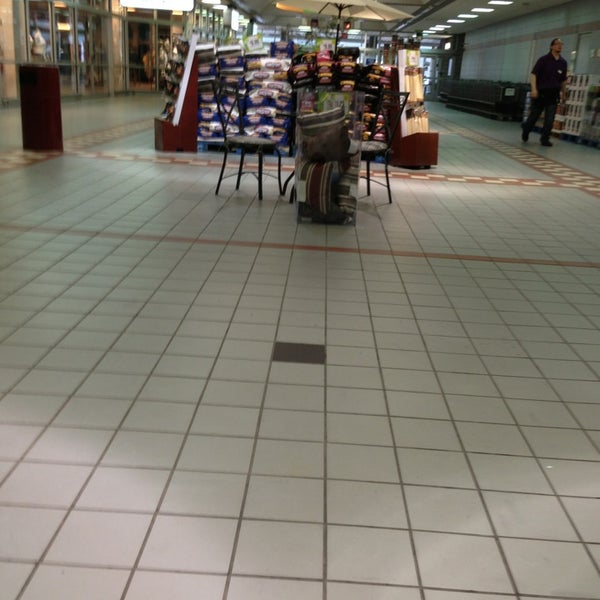
Identify the location of recessed lighting. This screenshot has width=600, height=600. (502, 2), (482, 8), (468, 16), (452, 20), (439, 26), (429, 31).